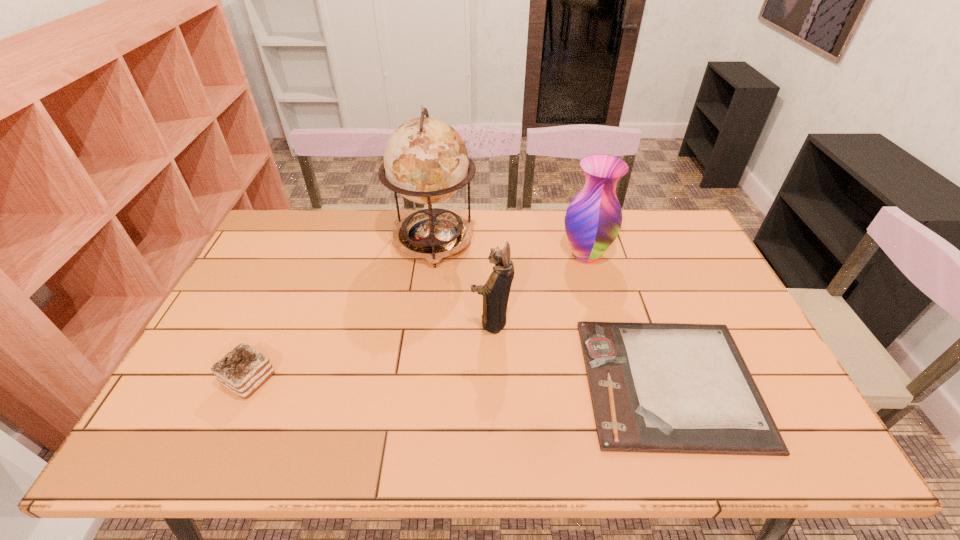
Identify the location of the tallest object. Image resolution: width=960 pixels, height=540 pixels. (426, 161).

Locate an element on the screen. This screenshot has width=960, height=540. vase is located at coordinates point(593,219).

This screenshot has width=960, height=540. Find the location of `figurine`. figurine is located at coordinates point(496,291).

Identify the location of the second shortest object. point(243,370).

At what (x,y) coordinates should I click in order to perform the action: click on chocolate cake. Please return your answer as a coordinate pair (x, y). The image size is (960, 540). Looking at the image, I should click on (243, 370).

Locate an element on the screen. The width and height of the screenshot is (960, 540). the shortest object is located at coordinates (655, 387).

Find the location of a particular element. This screenshot has height=540, width=960. vacant position located at the center of the tallest object is located at coordinates (422, 334).

Locate an element on the screen. This screenshot has height=540, width=960. free location located on the front of the vase is located at coordinates (620, 380).

The height and width of the screenshot is (540, 960). I want to click on vacant space located on the front-facing side of the figurine, so click(404, 322).

Find the location of a particular element. The width and height of the screenshot is (960, 540). free space located on the front-facing side of the figurine is located at coordinates point(404,322).